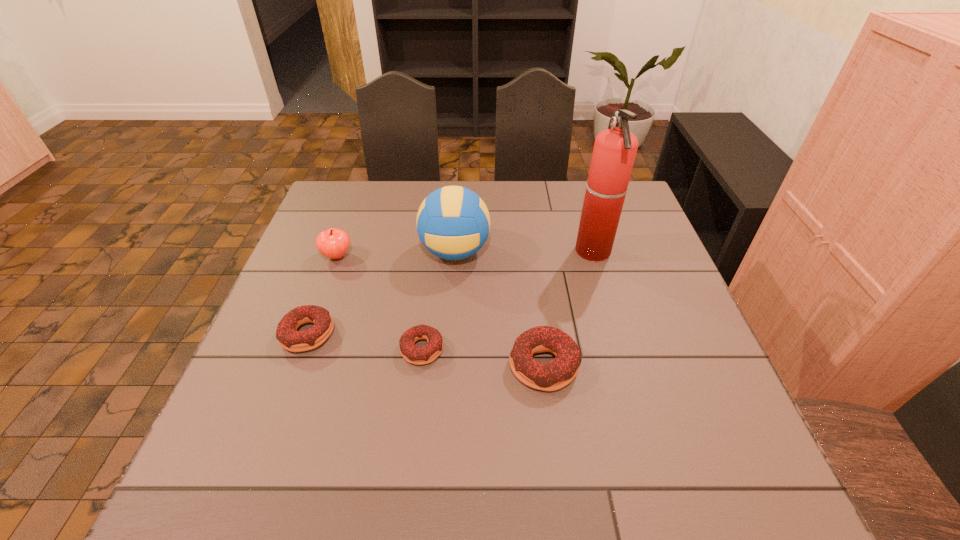
I want to click on free space that is in between the second doughnut from right to left and the second shortest object, so click(365, 342).

Where is `vacant area between the fire extinguisher and the shortest object`? This screenshot has height=540, width=960. vacant area between the fire extinguisher and the shortest object is located at coordinates (508, 300).

The height and width of the screenshot is (540, 960). I want to click on empty location between the volleyball and the rightmost object, so click(524, 252).

Where is `free area in between the rightmost object and the fifth tallest object`? This screenshot has width=960, height=540. free area in between the rightmost object and the fifth tallest object is located at coordinates (450, 293).

Find the location of a particular element. This screenshot has width=960, height=540. free space between the fifth tallest object and the second doughnut from right to left is located at coordinates (365, 342).

In order to click on free spot between the second shortest object and the fire extinguisher in this screenshot , I will do click(x=450, y=293).

Identify the location of the second closest object relative to the fire extinguisher. (453, 223).

The width and height of the screenshot is (960, 540). What are the coordinates of `object that stands as the fourth closest to the tallest object` in the screenshot? It's located at (333, 243).

Identify the location of doughnut that stands as the second closest to the fourth shortest object. The image size is (960, 540). (410, 352).

Select which doughnut is the closest to the apple. Please provide its 2D coordinates. Your answer should be formatted as a tuple, i.e. [(x, y)], where the tuple contains the x and y coordinates of a point satisfying the conditions above.

[(289, 338)]